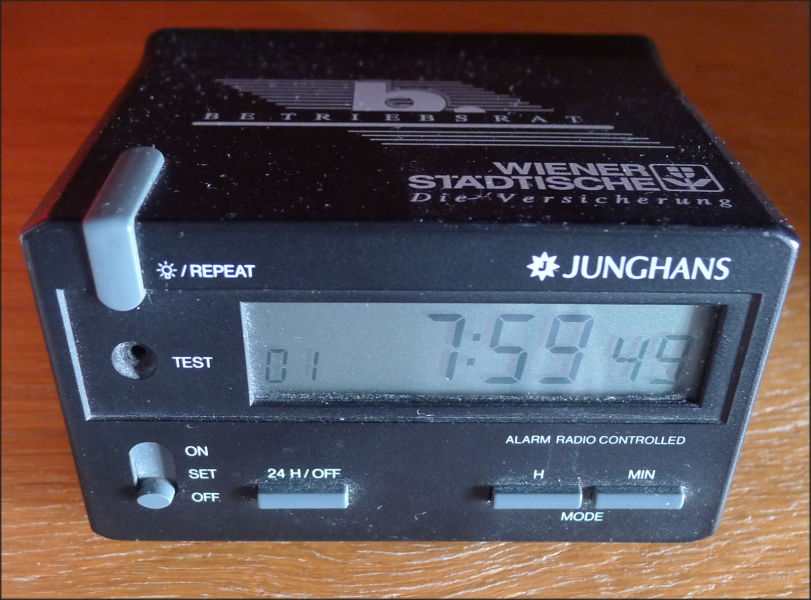
I want to click on wood table, so click(x=769, y=433).